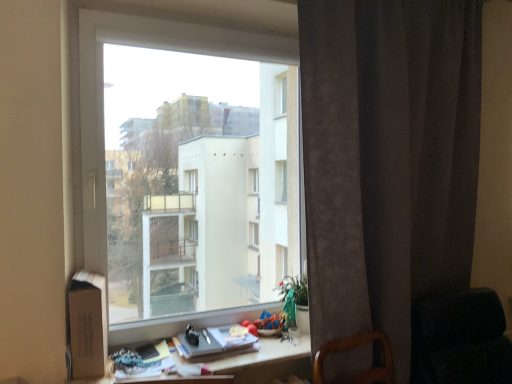
Locate an element on the screen. The image size is (512, 384). blank space situated above wooden desk at center (from a real-world perspective) is located at coordinates (207, 353).